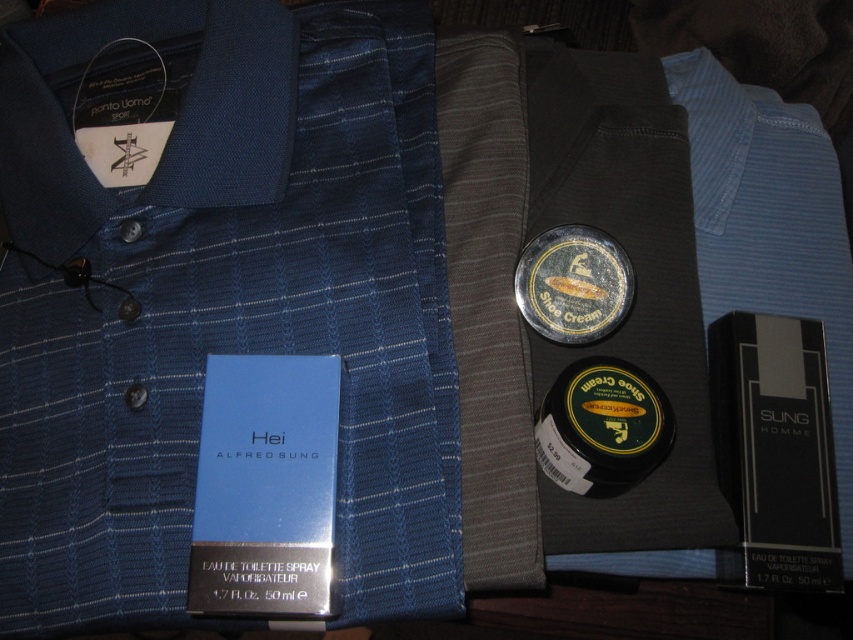
You are organizing a closet and have a shelf that can only hold items up to 12 inches in width. You need to place both the blue woven dress shirt at center and the blue cardboard box at center on this shelf. Based on their sizes, which item should you place first to ensure both fit?

The blue cardboard box at center has a smaller width than the blue woven dress shirt at center. To fit both items on the shelf, place the blue cardboard box at center first, then the blue woven dress shirt at center, ensuring their combined width does not exceed 12 inches.

You are standing in front of the clothing items and accessories arranged on the dark surface. You need to reach for the two points labeled point (355,520) and point (550,260). Which point is closer to you?

Point (355,520) is in front of point (550,260), so it is closer to you.

You are standing in front of the dark surface with the clothing items and accessories. There are two points marked on the surface. One is at coordinates point (4, 413) and the other at point (227, 362). Which point is closer to you?

Point (4, 413) is closer to you because it is further to the viewer than point (227, 362).